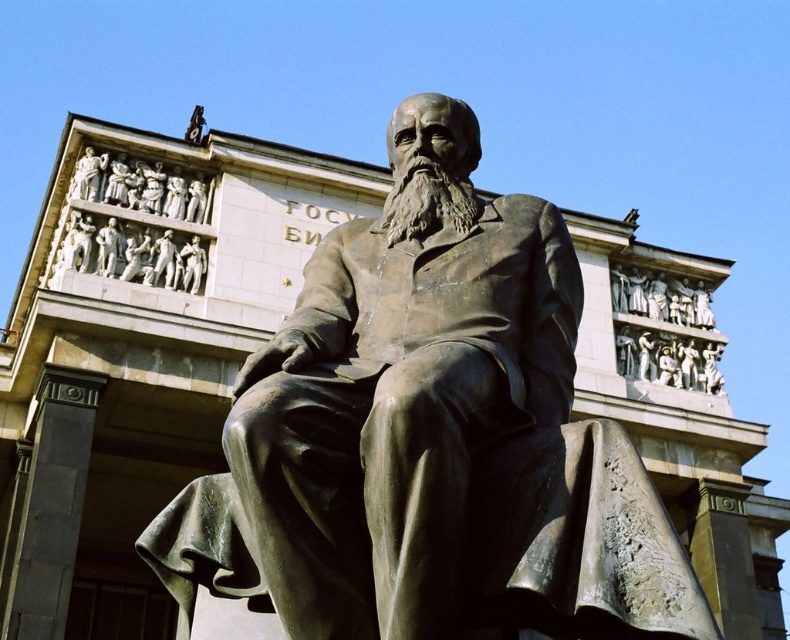
You are an art student analyzing the statue in the image. You notice the bronze statue at center and the brown metallic beard at center. Which object is taller?

The bronze statue at center is taller than the brown metallic beard at center.